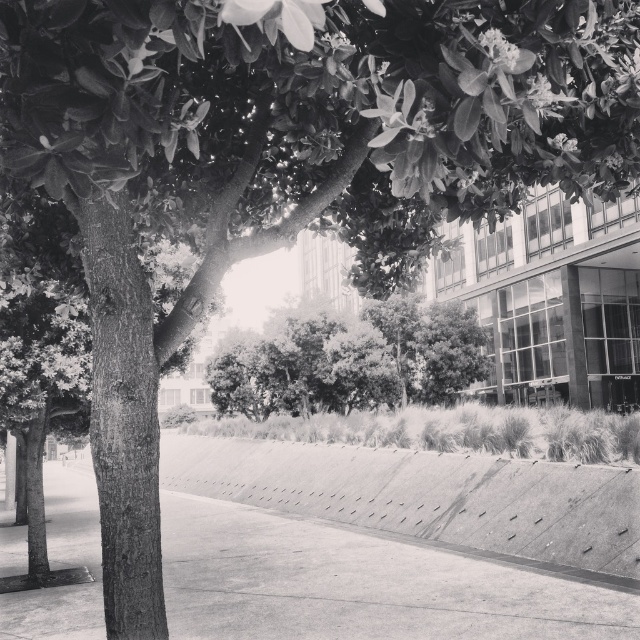
You are a pedestrian standing on the smooth concrete pavement at center. You want to walk towards the green leafy tree at center. Is the tree directly in front of you or behind you?

The smooth concrete pavement at center is in front of the green leafy tree at center, so the tree is behind you.

You are standing on the smooth concrete pavement at center and want to look up to see the green leafy tree at center. In which direction should you look?

You should look upward because the smooth concrete pavement at center is located below the green leafy tree at center.

You are standing at the entrance of the plaza and want to reach the smooth concrete pavement at center. According to the image, in which direction should you walk to reach it?

The smooth concrete pavement at center is located at point (358, 584) in the image, so you should walk towards the center of the image to reach it.